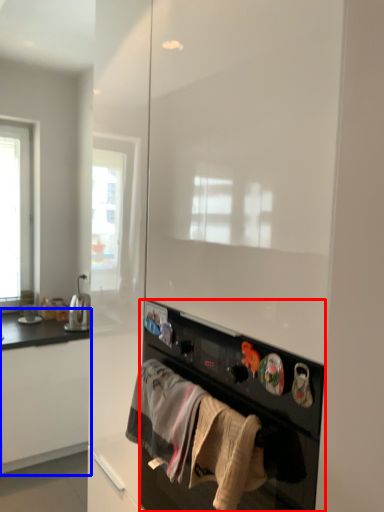
Question: Which object appears closest to the camera in this image, home appliance (highlighted by a red box) or cabinetry (highlighted by a blue box)?

Choices:
 (A) home appliance
 (B) cabinetry

Answer: (A)